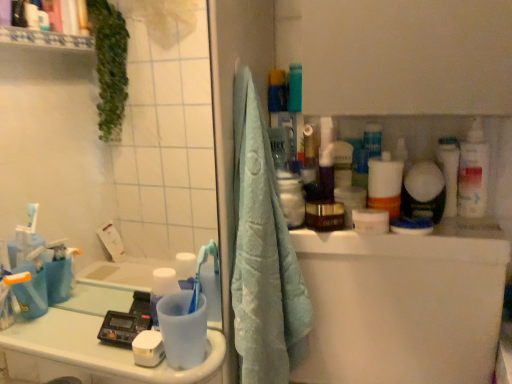
I want to click on white glossy toothbrush at upper right, so click(449, 172).

Measure the distance between point (49,338) and camera.

Point (49,338) is 30.75 inches from camera.

Image resolution: width=512 pixels, height=384 pixels. What are the coordinates of `white plastic bottle at right` in the screenshot? It's located at (473, 173).

Where is `white glossy toothbrush at upper right`? This screenshot has width=512, height=384. white glossy toothbrush at upper right is located at coordinates (449, 172).

Is transparent plastic mirror at upper left oriented towards light blue towel at center?

No, transparent plastic mirror at upper left is not oriented towards light blue towel at center.

In the scene shown: Would you say transparent plastic mirror at upper left is a long distance from light blue towel at center?

Yes.

Can light blue towel at center be found inside transparent plastic mirror at upper left?

No, light blue towel at center is not surrounded by transparent plastic mirror at upper left.

In the scene shown: Is light blue towel at center oriented towards blue plastic toothbrush at lower left?

No, light blue towel at center is not facing towards blue plastic toothbrush at lower left.

In the scene shown: Is light blue towel at center positioned before blue plastic toothbrush at lower left?

Yes, light blue towel at center is closer to the viewer.

Which point is more forward, (309, 321) or (206, 252)?

Point (309, 321)

Could blue plastic toothbrush at lower left be considered to be inside light blue towel at center?

No, blue plastic toothbrush at lower left is located outside of light blue towel at center.

Locate an element on the screen. This screenshot has height=384, width=512. mirror that appears in front of the blue plastic toothbrush at lower left is located at coordinates (115, 143).

From a real-world perspective, is transparent plastic mirror at upper left located beneath blue plastic toothbrush at lower left?

No.

Which of these two, transparent plastic mirror at upper left or blue plastic toothbrush at lower left, is wider?

Wider between the two is blue plastic toothbrush at lower left.

Is there a large distance between transparent plastic mirror at upper left and blue plastic toothbrush at lower left?

transparent plastic mirror at upper left is positioned a significant distance from blue plastic toothbrush at lower left.

Is blue plastic toothbrush at lower left at the back of white plastic bottle at right?

That's not correct — white plastic bottle at right is not looking away from blue plastic toothbrush at lower left.

Between white plastic bottle at right and blue plastic toothbrush at lower left, which one appears on the left side from the viewer's perspective?

Positioned to the left is blue plastic toothbrush at lower left.

Choose the correct answer: Is white plastic bottle at right inside blue plastic toothbrush at lower left or outside it?

white plastic bottle at right exists outside the volume of blue plastic toothbrush at lower left.

The height and width of the screenshot is (384, 512). In the image, there is a blue plastic toothbrush at lower left. Find the location of `cleaning product above it (from the image's perspective)`. cleaning product above it (from the image's perspective) is located at coordinates point(473,173).

In the scene shown: Is white glossy counter top at lower left completely or partially inside blue plastic toothbrush at lower left?

That's incorrect, white glossy counter top at lower left is not inside blue plastic toothbrush at lower left.

From a real-world perspective, between blue plastic toothbrush at lower left and white glossy counter top at lower left, who is vertically higher?

blue plastic toothbrush at lower left.

From the image's perspective, between blue plastic toothbrush at lower left and white glossy counter top at lower left, who is located below?

white glossy counter top at lower left.

Consider the image. Who is bigger, blue plastic toothbrush at lower left or white glossy counter top at lower left?

With larger size is white glossy counter top at lower left.

Which object is wider, blue plastic toothbrush at lower left or white plastic bottle at right?

white plastic bottle at right.

Who is shorter, blue plastic toothbrush at lower left or white plastic bottle at right?

blue plastic toothbrush at lower left is shorter.

From the image's perspective, between blue plastic toothbrush at lower left and white plastic bottle at right, who is located below?

blue plastic toothbrush at lower left appears lower in the image.

Is blue plastic toothbrush at lower left behind white plastic bottle at right?

No.

Would you say white plastic bottle at right is part of white glossy counter top at lower left's contents?

No, white glossy counter top at lower left does not contain white plastic bottle at right.

In the scene shown: Can you tell me how much white glossy counter top at lower left and white plastic bottle at right differ in facing direction?

2.46 degrees separate the facing orientations of white glossy counter top at lower left and white plastic bottle at right.

From the image's perspective, is white glossy counter top at lower left above white plastic bottle at right?

Incorrect, from the image's perspective, white glossy counter top at lower left is lower than white plastic bottle at right.

Find the location of a particular element. This screenshot has height=384, width=512. counter top on the left side of white plastic bottle at right is located at coordinates (91, 353).

In order to click on mirror lying behind the light blue towel at center in this screenshot , I will do `click(115, 143)`.

Where is `bath towel to the right of blue plastic toothbrush at lower left`? Image resolution: width=512 pixels, height=384 pixels. bath towel to the right of blue plastic toothbrush at lower left is located at coordinates pyautogui.click(x=263, y=254).

Which object lies further to the anchor point white glossy toothbrush at upper right, white plastic bottle at right or transparent plastic mirror at upper left?

transparent plastic mirror at upper left.

Based on their spatial positions, is transparent plastic mirror at upper left or white plastic bottle at right closer to light blue towel at center?

white plastic bottle at right lies closer to light blue towel at center than the other object.

When comparing their distances from light blue towel at center, does blue plastic toothbrush at lower left or transparent plastic mirror at upper left seem closer?

The object closer to light blue towel at center is blue plastic toothbrush at lower left.

Estimate the real-world distances between objects in this image. Which object is closer to white glossy toothbrush at upper right, transparent plastic mirror at upper left or light blue towel at center?

Based on the image, light blue towel at center appears to be nearer to white glossy toothbrush at upper right.

From the image, which object appears to be nearer to white glossy toothbrush at upper right, transparent plastic mirror at upper left or white glossy counter top at lower left?

Based on the image, white glossy counter top at lower left appears to be nearer to white glossy toothbrush at upper right.

Considering their positions, is transparent plastic mirror at upper left positioned further to white glossy counter top at lower left than blue plastic toothbrush at lower left?

transparent plastic mirror at upper left is further to white glossy counter top at lower left.

When comparing their distances from transparent plastic mirror at upper left, does white glossy toothbrush at upper right or white plastic bottle at right seem further?

Based on the image, white plastic bottle at right appears to be further to transparent plastic mirror at upper left.

Which object lies nearer to the anchor point light blue towel at center, white plastic bottle at right or blue plastic toothbrush at lower left?

blue plastic toothbrush at lower left.

Locate an element on the screen. Image resolution: width=512 pixels, height=384 pixels. bath towel located between transparent plastic mirror at upper left and white plastic bottle at right in the left-right direction is located at coordinates (x=263, y=254).

What are the coordinates of `bath towel located between white glossy counter top at lower left and white plastic bottle at right in the left-right direction` in the screenshot? It's located at (263, 254).

This screenshot has height=384, width=512. What are the coordinates of `counter top between transparent plastic mirror at upper left and white plastic bottle at right` in the screenshot? It's located at (91, 353).

I want to click on toothbrush between white glossy counter top at lower left and white glossy toothbrush at upper right, so click(198, 279).